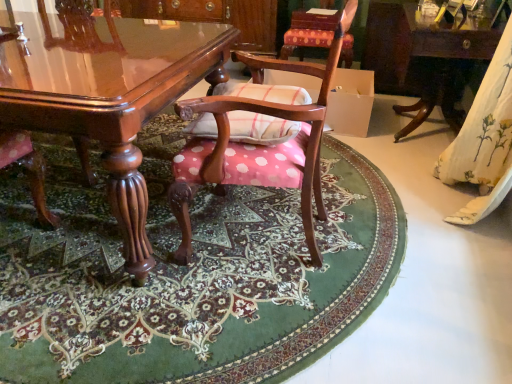
Where is `vacant region below white floral fabric at right (from a real-world perspective)`? vacant region below white floral fabric at right (from a real-world perspective) is located at coordinates (470, 217).